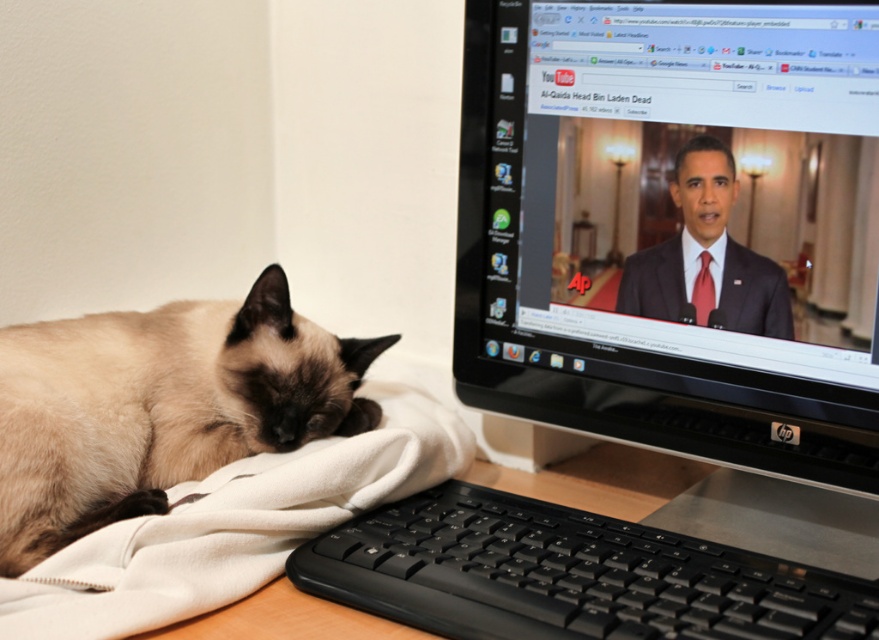
Question: Can you confirm if black plastic monitor at upper right is smaller than smokey brown fur at lower left?

Choices:
 (A) yes
 (B) no

Answer: (B)

Question: Is black plastic monitor at upper right to the left of black plastic keyboard at lower center from the viewer's perspective?

Choices:
 (A) no
 (B) yes

Answer: (A)

Question: Estimate the real-world distances between objects in this image. Which object is closer to the smokey brown fur at lower left?

Choices:
 (A) black plastic keyboard at lower center
 (B) white soft blanket at lower left
 (C) black plastic monitor at upper right

Answer: (B)

Question: Is black plastic monitor at upper right to the right of black plastic keyboard at lower center from the viewer's perspective?

Choices:
 (A) yes
 (B) no

Answer: (A)

Question: Which point is farther to the camera?

Choices:
 (A) (173, 616)
 (B) (240, 456)
 (C) (419, 518)
 (D) (681, 310)

Answer: (B)

Question: Which point is closer to the camera?

Choices:
 (A) smokey brown fur at lower left
 (B) white soft blanket at lower left

Answer: (B)